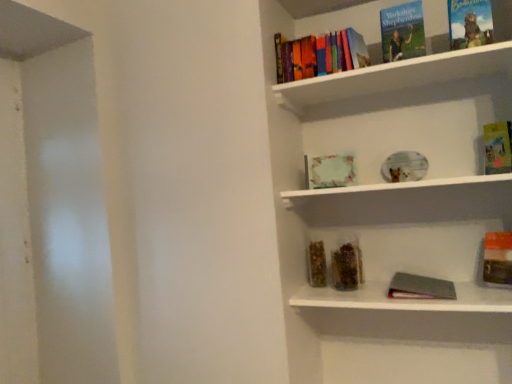
Question: Is point coord(438,279) positioned closer to the camera than point coord(459,178)?

Choices:
 (A) farther
 (B) closer

Answer: (B)

Question: From a real-world perspective, is gray matte book at lower right, which is counted as the 8th book, starting from the top, positioned above or below white matte plate at center, which is counted as the 1th window sill, starting from the top?

Choices:
 (A) below
 (B) above

Answer: (A)

Question: Considering the real-world distances, which object is farthest from the hardcover book at upper right, which is counted as the 5th book, starting from the bottom?

Choices:
 (A) white matte plate at center, which is counted as the 1th window sill, starting from the top
 (B) hardcover book at upper center, marked as the seventh book in a bottom-to-top arrangement
 (C) orange matte book at lower right, positioned as the third book in bottom-to-top order
 (D) hardcover books at upper center, which is the sixth book in bottom-to-top order
 (E) pastel paper frame at center, which appears as the fifth book when viewed from the top

Answer: (D)

Question: Estimate the real-world distances between objects in this image. Which object is farther from the translucent plastic container at center, arranged as the second book when ordered from the bottom?

Choices:
 (A) orange matte book at lower right, positioned as the third book in bottom-to-top order
 (B) hardcover books at upper center
 (C) hardcover books at upper center, marked as the 3th book in a top-to-bottom arrangement
 (D) white matte plate at center, the 2th window sill ordered from the bottom
 (E) hardcover book at upper right, the 4th book when ordered from top to bottom

Answer: (E)